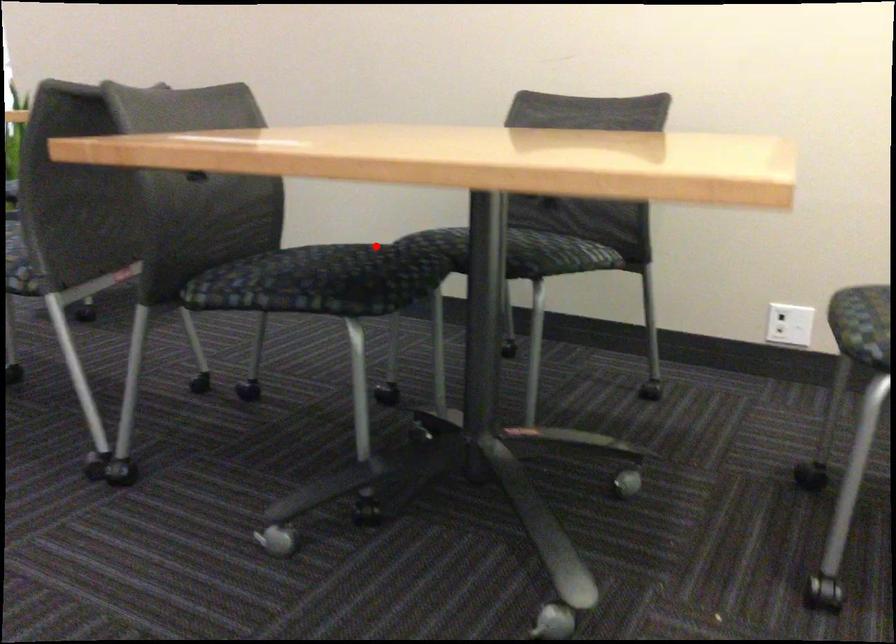
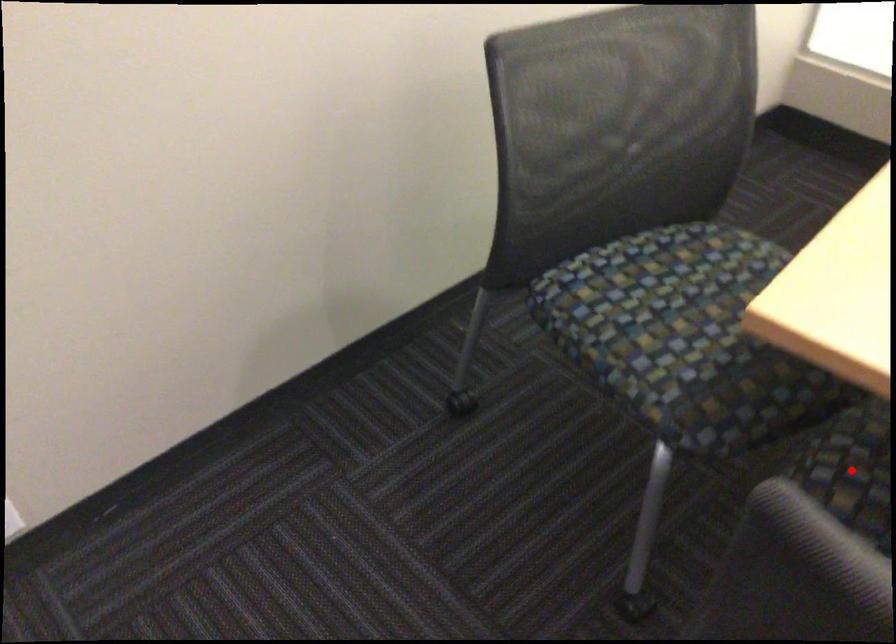
I am providing you with two images of the same scene from different viewpoints. A red point is marked on the first image and another point is marked on the second image. Is the marked point in image1 the same physical position as the marked point in image2?

Yes